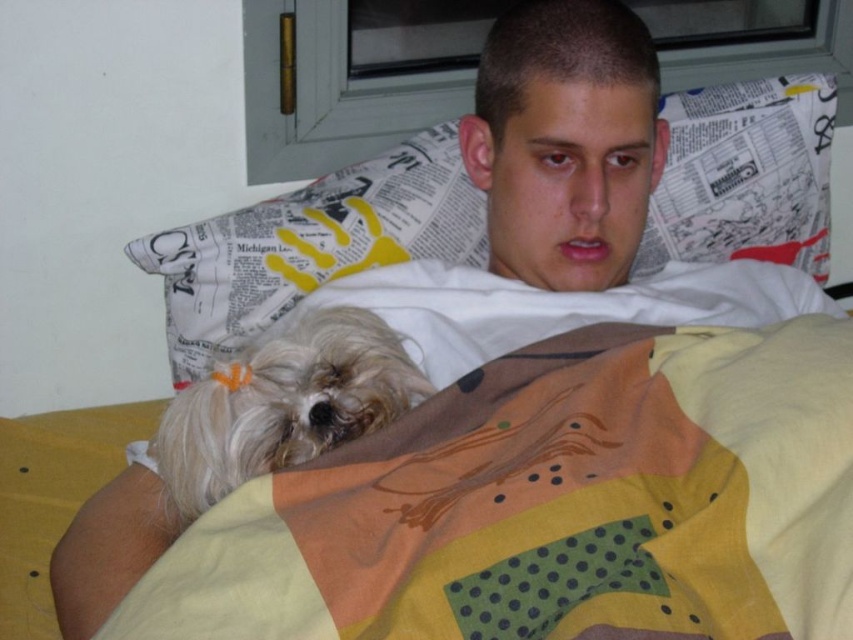
Question: Among these objects, which one is farthest from the camera?

Choices:
 (A) white fluffy dog at lower left
 (B) white newspaper at upper center
 (C) yellow cotton blanket at lower left

Answer: (B)

Question: Can you confirm if yellow cotton blanket at lower left is wider than white newspaper at upper center?

Choices:
 (A) yes
 (B) no

Answer: (A)

Question: Among these points, which one is farthest from the camera?

Choices:
 (A) (804, 196)
 (B) (840, 579)
 (C) (393, 333)

Answer: (A)

Question: Which of the following is the closest to the observer?

Choices:
 (A) yellow cotton blanket at lower left
 (B) white fluffy dog at lower left
 (C) white newspaper at upper center

Answer: (A)

Question: Does yellow cotton blanket at lower left appear over white newspaper at upper center?

Choices:
 (A) no
 (B) yes

Answer: (A)

Question: Can you confirm if yellow cotton blanket at lower left is smaller than white newspaper at upper center?

Choices:
 (A) no
 (B) yes

Answer: (A)